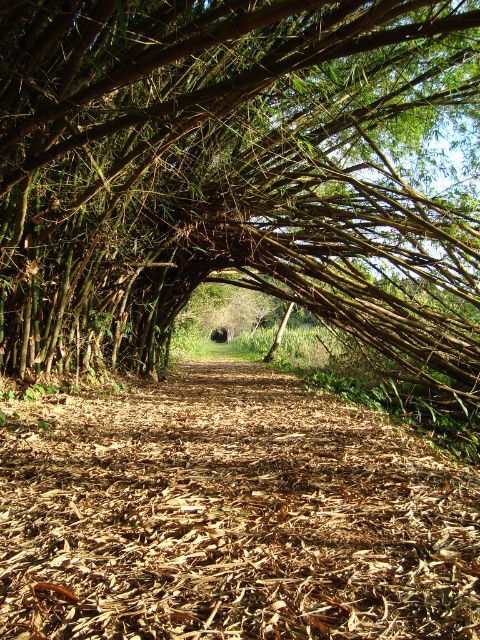
Between green leafy tree at center and brown mulch trail at center, which one is positioned lower?

brown mulch trail at center

Is point (34, 256) behind point (273, 609)?

Yes, point (34, 256) is farther from viewer.

Locate an element on the screen. green leafy tree at center is located at coordinates (228, 172).